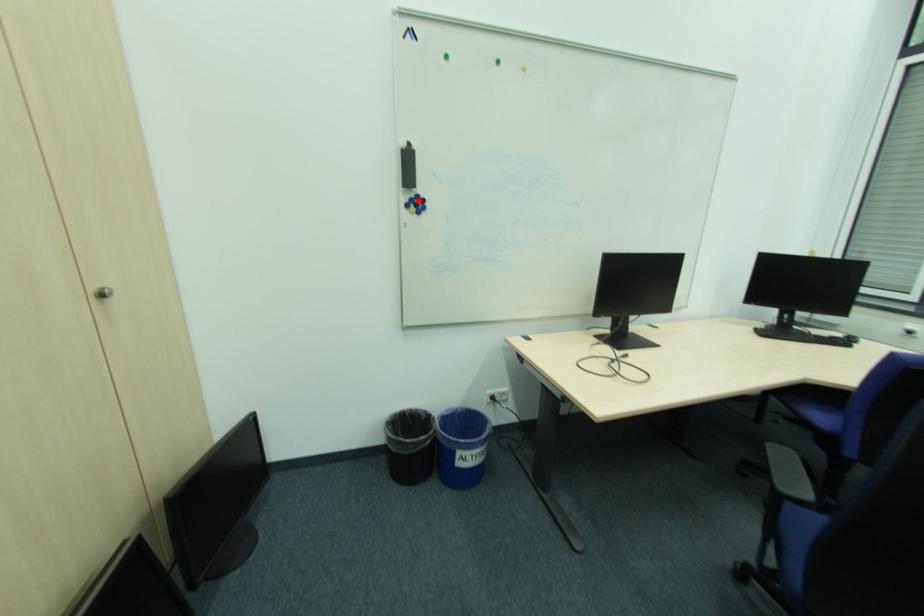
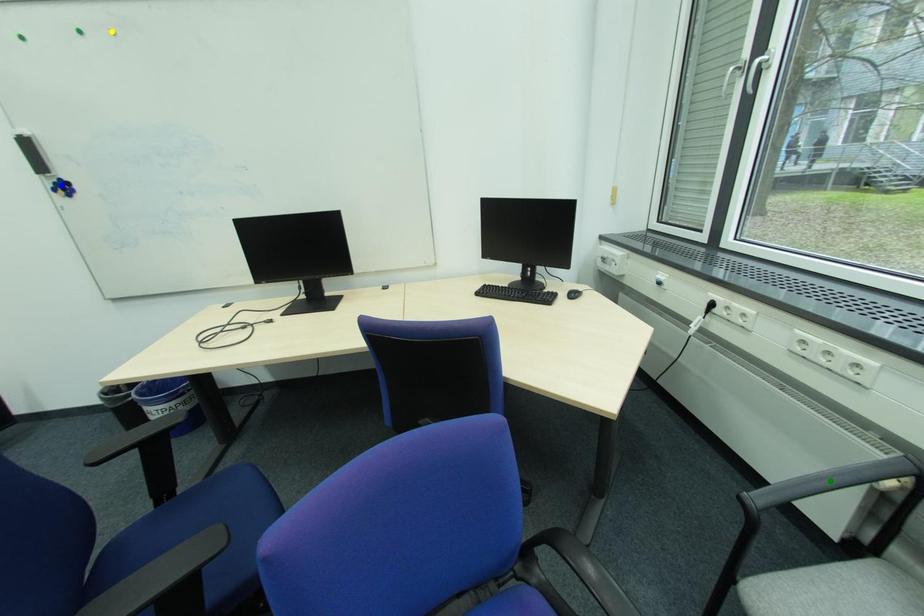
Question: I am providing you with two images of the same scene from different viewpoints. A red point is marked on the first image. You are given multiple points on the second image. Which point in image 2 is actually the same real-world point as the red point in image 1?

Choices:
 (A) blue point
 (B) yellow point
 (C) green point

Answer: (A)